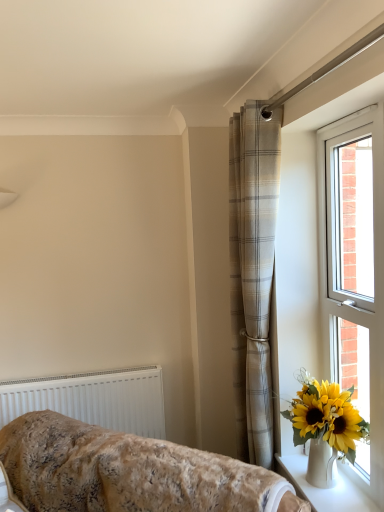
Question: Does fluffy beige blanket at lower left appear on the right side of white plastic radiator at lower left?

Choices:
 (A) yes
 (B) no

Answer: (A)

Question: Is fluffy beige blanket at lower left not within white plastic radiator at lower left?

Choices:
 (A) no
 (B) yes

Answer: (B)

Question: Is fluffy beige blanket at lower left looking in the opposite direction of white plastic radiator at lower left?

Choices:
 (A) yes
 (B) no

Answer: (A)

Question: Is fluffy beige blanket at lower left further to camera compared to white plastic radiator at lower left?

Choices:
 (A) no
 (B) yes

Answer: (A)

Question: From the image's perspective, does fluffy beige blanket at lower left appear higher than white plastic radiator at lower left?

Choices:
 (A) yes
 (B) no

Answer: (B)

Question: Is fluffy beige blanket at lower left to the left of white plastic radiator at lower left from the viewer's perspective?

Choices:
 (A) yes
 (B) no

Answer: (B)

Question: Does fluffy beige blanket at lower left have a greater width compared to white plastic window at right?

Choices:
 (A) yes
 (B) no

Answer: (A)

Question: From a real-world perspective, does fluffy beige blanket at lower left sit lower than white plastic window at right?

Choices:
 (A) yes
 (B) no

Answer: (A)

Question: Is fluffy beige blanket at lower left not inside white plastic window at right?

Choices:
 (A) yes
 (B) no

Answer: (A)

Question: Would you say white plastic window at right is part of fluffy beige blanket at lower left's contents?

Choices:
 (A) no
 (B) yes

Answer: (A)

Question: Is fluffy beige blanket at lower left at the left side of white plastic window at right?

Choices:
 (A) no
 (B) yes

Answer: (B)

Question: Is fluffy beige blanket at lower left far away from white plastic window at right?

Choices:
 (A) yes
 (B) no

Answer: (B)

Question: From a real-world perspective, is beige plaid curtain at center located beneath white ceramic vase at lower right?

Choices:
 (A) yes
 (B) no

Answer: (B)